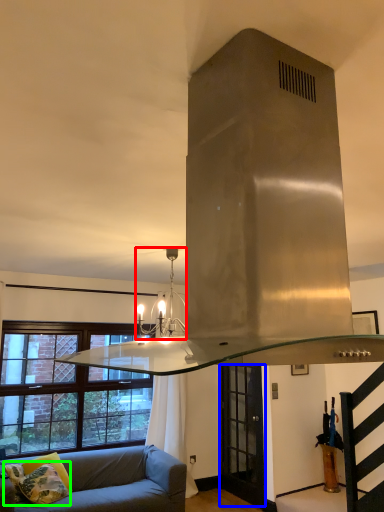
Question: Based on their relative distances, which object is nearer to light fixture (highlighted by a red box)? Choose from glass door (highlighted by a blue box) and pillow (highlighted by a green box).

Choices:
 (A) glass door
 (B) pillow

Answer: (B)